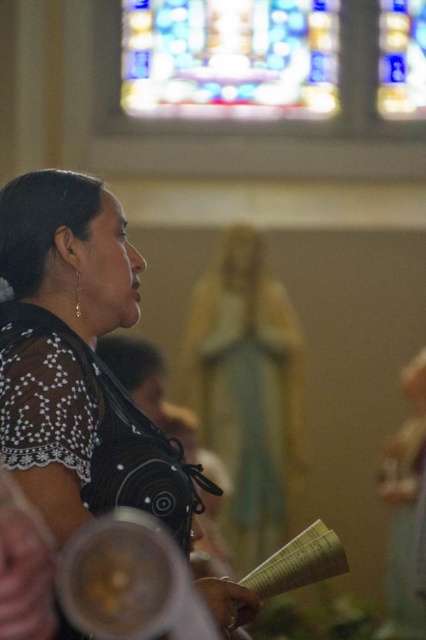
Based on the photo, who is taller, black lace dress at left or white paper book at lower center?

With more height is black lace dress at left.

Describe the element at coordinates (77, 362) in the screenshot. I see `black lace dress at left` at that location.

Does point (115, 317) lie in front of point (296, 570)?

No, (115, 317) is further to viewer.

At what (x,y) coordinates should I click in order to perform the action: click on black lace dress at left. Please return your answer as a coordinate pair (x, y). The width and height of the screenshot is (426, 640). Looking at the image, I should click on (77, 362).

This screenshot has height=640, width=426. I want to click on black lace dress at left, so click(77, 362).

Is point (34, 227) less distant than point (250, 68)?

Yes, point (34, 227) is in front of point (250, 68).

This screenshot has height=640, width=426. I want to click on black lace dress at left, so click(77, 362).

I want to click on black lace dress at left, so click(77, 362).

Who is shorter, stained glass window at upper center or white paper book at lower center?

Standing shorter between the two is white paper book at lower center.

Is the position of stained glass window at upper center more distant than that of white paper book at lower center?

Yes.

Is point (301, 26) positioned before point (325, 557)?

No.

Where is `stained glass window at upper center`? stained glass window at upper center is located at coordinates (230, 58).